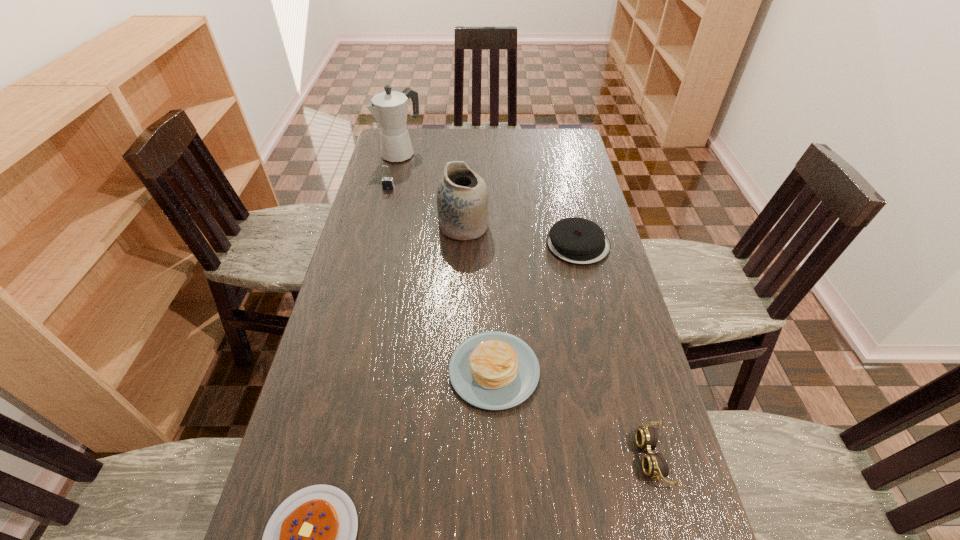
Find the location of a particular element. The image size is (960, 540). vacant area that lies between the goggles and the sixth shortest object is located at coordinates (558, 341).

Locate an element on the screen. vacant area that lies between the farthest pancake and the sixth shortest object is located at coordinates (521, 235).

I want to click on vacant space that is in between the pottery and the second nearest pancake, so click(x=479, y=299).

At what (x,y) coordinates should I click in order to perform the action: click on vacant area that lies between the rightmost pancake and the farthest object. Please return your answer as a coordinate pair (x, y). Looking at the image, I should click on (490, 199).

Where is `object that is the third closest to the second nearest pancake`? This screenshot has width=960, height=540. object that is the third closest to the second nearest pancake is located at coordinates (578, 241).

Where is `object that stands as the third closest to the leftmost pancake`? The width and height of the screenshot is (960, 540). object that stands as the third closest to the leftmost pancake is located at coordinates click(x=462, y=195).

Image resolution: width=960 pixels, height=540 pixels. I want to click on pancake that is the second closest to the fifth farthest object, so click(x=578, y=241).

I want to click on pancake that is the third closest to the second tallest object, so click(310, 538).

I want to click on free space that satisfies the following two spatial constraints: 1. on the shackle of the sixth nearest object; 2. on the right side of the second nearest pancake, so click(x=344, y=370).